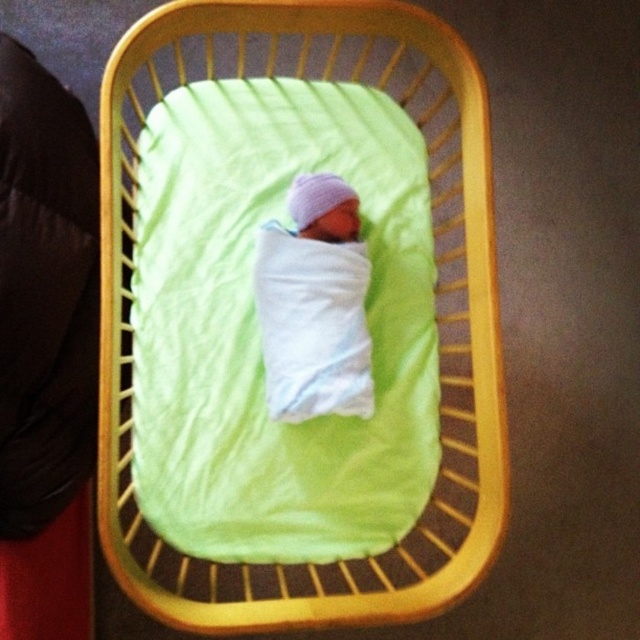
You are a caregiver holding a small toy that is 10 centimeters long. You want to place it near the baby without getting too close to the white soft swaddled newborn at center. Can you safely place the toy within the wooden crib at center?

The wooden crib at center and white soft swaddled newborn at center are 23.73 centimeters apart from each other. Since the toy is only 10 centimeters long, there is enough space between them to place the toy safely without getting too close to the baby.